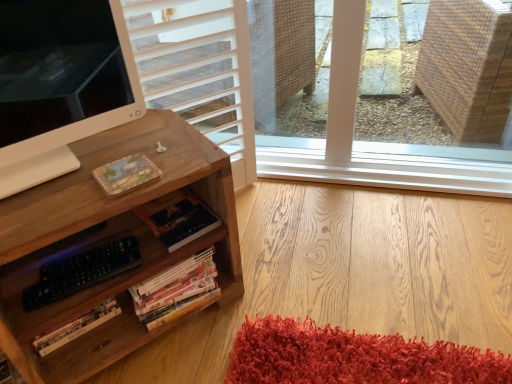
Locate an element on the screen. hardcover books at lower center, which is counted as the 2th book, starting from the top is located at coordinates (179, 291).

Identify the location of hardcover books at lower center, which is counted as the 2th book, starting from the top. (179, 291).

Does hardcover book at center, the 2th book in the bottom-to-top sequence, come behind wooden desk at left?

That is True.

Is hardcover book at center, the 2th book in the bottom-to-top sequence, directly adjacent to wooden desk at left?

hardcover book at center, the 2th book in the bottom-to-top sequence, and wooden desk at left are clearly separated.

You are a GUI agent. You are given a task and a screenshot of the screen. Output one action in this format:
    pyautogui.click(x=<x>, y=<y>)
    Task: Click on the desk that appears below the hardcover book at center, the 2th book in the bottom-to-top sequence (from the image's perspective)
    
    Given the screenshot: What is the action you would take?
    pyautogui.click(x=106, y=241)

Is there a large distance between hardcover books at lower center, which is counted as the 2th book, starting from the top, and wooden desk at left?

No, hardcover books at lower center, which is counted as the 2th book, starting from the top, is in close proximity to wooden desk at left.

Where is `desk in front of the hardcover books at lower center, marked as the 1th book in a bottom-to-top arrangement`? This screenshot has width=512, height=384. desk in front of the hardcover books at lower center, marked as the 1th book in a bottom-to-top arrangement is located at coordinates (106, 241).

Considering the positions of point (159, 322) and point (184, 182), is point (159, 322) closer or farther from the camera than point (184, 182)?

Clearly, point (159, 322) is more distant from the camera than point (184, 182).

Does point (179, 226) come farther from viewer compared to point (199, 257)?

That is False.

Can we say hardcover book at center, the 2th book in the bottom-to-top sequence, lies outside hardcover books at lower center, which is counted as the 2th book, starting from the top?

Indeed, hardcover book at center, the 2th book in the bottom-to-top sequence, is completely outside hardcover books at lower center, which is counted as the 2th book, starting from the top.

Could you tell me if hardcover book at center, the 2th book in the bottom-to-top sequence, is turned towards hardcover books at lower center, marked as the 1th book in a bottom-to-top arrangement?

No, hardcover book at center, the 2th book in the bottom-to-top sequence, is not facing towards hardcover books at lower center, marked as the 1th book in a bottom-to-top arrangement.

Looking at this image, which object is closer to the camera, hardcover book at center, the 1th book viewed from the top, or hardcover books at lower center, which is counted as the 2th book, starting from the top?

Positioned in front is hardcover books at lower center, which is counted as the 2th book, starting from the top.

Is wooden desk at left situated inside hardcover book at center, the 1th book viewed from the top, or outside?

wooden desk at left is outside hardcover book at center, the 1th book viewed from the top.

Which object is thinner, wooden desk at left or hardcover book at center, the 2th book in the bottom-to-top sequence?

With smaller width is hardcover book at center, the 2th book in the bottom-to-top sequence.

The height and width of the screenshot is (384, 512). I want to click on desk located on the left of hardcover book at center, the 2th book in the bottom-to-top sequence, so click(x=106, y=241).

From a real-world perspective, is wooden desk at left under hardcover book at center, the 1th book viewed from the top?

Yes.

In the scene shown: Are wooden desk at left and hardcover books at lower center, marked as the 1th book in a bottom-to-top arrangement, far apart?

No, there isn't a large distance between wooden desk at left and hardcover books at lower center, marked as the 1th book in a bottom-to-top arrangement.

Between wooden desk at left and hardcover books at lower center, marked as the 1th book in a bottom-to-top arrangement, which one is positioned behind?

hardcover books at lower center, marked as the 1th book in a bottom-to-top arrangement, is behind.

Do you think wooden desk at left is within hardcover books at lower center, which is counted as the 2th book, starting from the top, or outside of it?

wooden desk at left cannot be found inside hardcover books at lower center, which is counted as the 2th book, starting from the top.

Is wooden desk at left looking in the opposite direction of hardcover books at lower center, marked as the 1th book in a bottom-to-top arrangement?

No, wooden desk at left's orientation is not away from hardcover books at lower center, marked as the 1th book in a bottom-to-top arrangement.

Is hardcover books at lower center, marked as the 1th book in a bottom-to-top arrangement, smaller than hardcover book at center, the 1th book viewed from the top?

Incorrect, hardcover books at lower center, marked as the 1th book in a bottom-to-top arrangement, is not smaller in size than hardcover book at center, the 1th book viewed from the top.

From the image's perspective, would you say hardcover books at lower center, which is counted as the 2th book, starting from the top, is positioned over hardcover book at center, the 2th book in the bottom-to-top sequence?

No, from the image's perspective, hardcover books at lower center, which is counted as the 2th book, starting from the top, is not on top of hardcover book at center, the 2th book in the bottom-to-top sequence.

Is hardcover books at lower center, marked as the 1th book in a bottom-to-top arrangement, in front of or behind hardcover book at center, the 2th book in the bottom-to-top sequence, in the image?

Visually, hardcover books at lower center, marked as the 1th book in a bottom-to-top arrangement, is located in front of hardcover book at center, the 2th book in the bottom-to-top sequence.

Is hardcover books at lower center, which is counted as the 2th book, starting from the top, not within hardcover book at center, the 2th book in the bottom-to-top sequence?

That's correct, hardcover books at lower center, which is counted as the 2th book, starting from the top, is outside of hardcover book at center, the 2th book in the bottom-to-top sequence.

Locate an element on the screen. The height and width of the screenshot is (384, 512). desk that appears below the hardcover book at center, the 2th book in the bottom-to-top sequence (from the image's perspective) is located at coordinates (106, 241).

Identify the location of book that appears below the wooden desk at left (from a real-world perspective). This screenshot has height=384, width=512. (179, 291).

Which object lies further to the anchor point hardcover book at center, the 2th book in the bottom-to-top sequence, hardcover books at lower center, which is counted as the 2th book, starting from the top, or wooden desk at left?

Among the two, wooden desk at left is located further to hardcover book at center, the 2th book in the bottom-to-top sequence.

From the image, which object appears to be nearer to hardcover book at center, the 1th book viewed from the top, wooden desk at left or hardcover books at lower center, which is counted as the 2th book, starting from the top?

The object closer to hardcover book at center, the 1th book viewed from the top, is hardcover books at lower center, which is counted as the 2th book, starting from the top.

Looking at the image, which one is located closer to wooden desk at left, hardcover books at lower center, which is counted as the 2th book, starting from the top, or hardcover book at center, the 1th book viewed from the top?

Among the two, hardcover books at lower center, which is counted as the 2th book, starting from the top, is located nearer to wooden desk at left.

Considering their positions, is hardcover book at center, the 1th book viewed from the top, positioned further to hardcover books at lower center, which is counted as the 2th book, starting from the top, than wooden desk at left?

Based on the image, wooden desk at left appears to be further to hardcover books at lower center, which is counted as the 2th book, starting from the top.

Considering their positions, is hardcover book at center, the 2th book in the bottom-to-top sequence, positioned closer to wooden desk at left than hardcover books at lower center, marked as the 1th book in a bottom-to-top arrangement?

hardcover books at lower center, marked as the 1th book in a bottom-to-top arrangement, is positioned closer to the anchor wooden desk at left.

Which object lies further to the anchor point hardcover books at lower center, which is counted as the 2th book, starting from the top, wooden desk at left or hardcover book at center, the 1th book viewed from the top?

Among the two, wooden desk at left is located further to hardcover books at lower center, which is counted as the 2th book, starting from the top.

The height and width of the screenshot is (384, 512). In order to click on book between wooden desk at left and hardcover book at center, the 2th book in the bottom-to-top sequence, from front to back in this screenshot , I will do `click(179, 291)`.